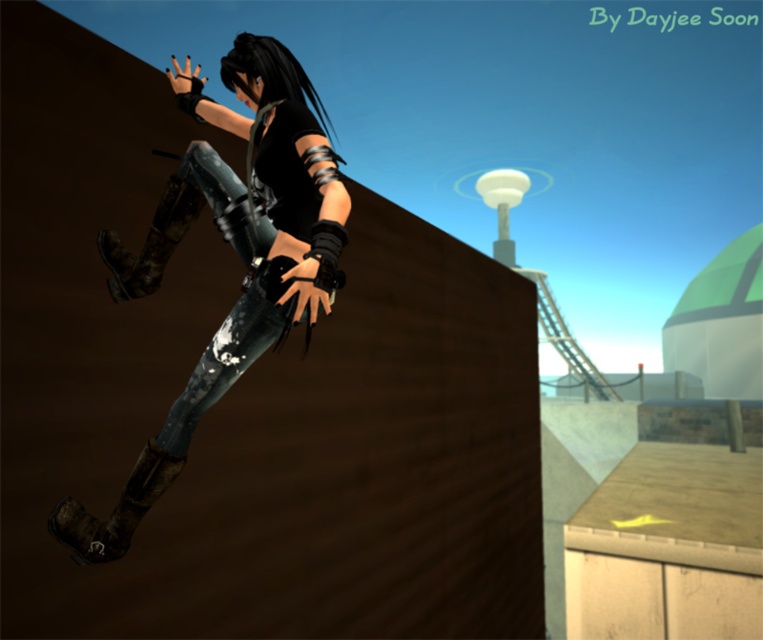
Is the position of muddy leather boot at lower left more distant than that of camouflage fabric boot at left?

No, muddy leather boot at lower left is in front of camouflage fabric boot at left.

Can you confirm if muddy leather boot at lower left is smaller than camouflage fabric boot at left?

Indeed, muddy leather boot at lower left has a smaller size compared to camouflage fabric boot at left.

Between point (69, 516) and point (169, 243), which one is positioned behind?

Positioned behind is point (169, 243).

The image size is (763, 640). In order to click on muddy leather boot at lower left in this screenshot , I will do `click(114, 509)`.

Can you confirm if denim jeans at left is wider than camouflage fabric boot at left?

Yes, denim jeans at left is wider than camouflage fabric boot at left.

The height and width of the screenshot is (640, 763). I want to click on denim jeans at left, so click(237, 253).

Is point (195, 113) farther from camera compared to point (121, 253)?

Yes, it is behind point (121, 253).

I want to click on denim jeans at left, so click(237, 253).

Does point (118, 529) come behind point (139, 515)?

No, it is in front of (139, 515).

Which is above, denim jeans at left or muddy leather boot at lower left?

denim jeans at left

Does point (275, 234) come closer to viewer compared to point (66, 518)?

No, it is not.

You are a GUI agent. You are given a task and a screenshot of the screen. Output one action in this format:
    pyautogui.click(x=<x>, y=<y>)
    Task: Click on the denim jeans at left
    This screenshot has width=763, height=640.
    Given the screenshot: What is the action you would take?
    (x=237, y=253)